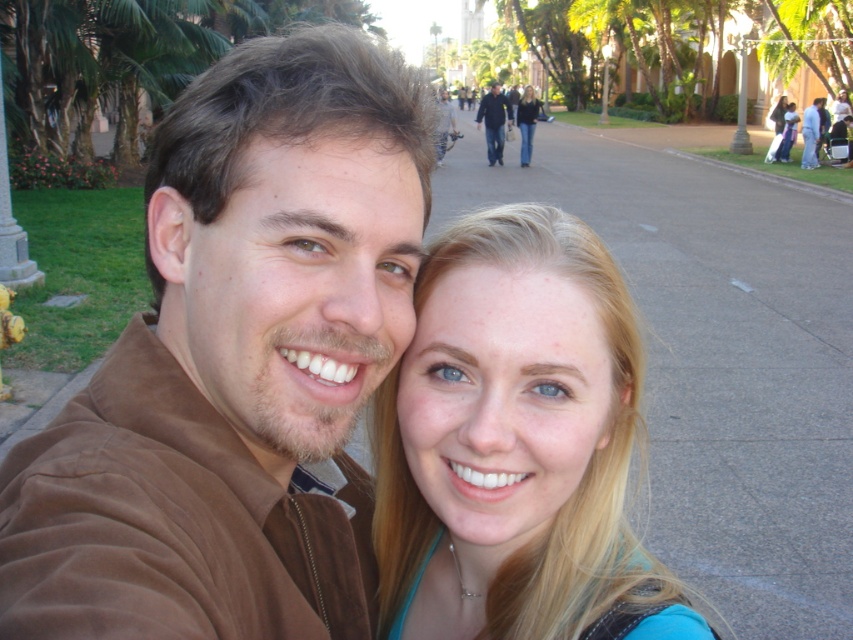
Question: Observing the image, what is the correct spatial positioning of blonde hair at center in reference to dark blue jeans at center?

Choices:
 (A) below
 (B) above

Answer: (A)

Question: Is matte brown jacket at upper right in front of blonde hair at upper center?

Choices:
 (A) yes
 (B) no

Answer: (A)

Question: Estimate the real-world distances between objects in this image. Which object is farther from the blue jeans at center?

Choices:
 (A) blonde hair at upper center
 (B) brown suede jacket at upper left

Answer: (B)

Question: Among these points, which one is farthest from the camera?

Choices:
 (A) (198, 278)
 (B) (486, 145)
 (C) (521, 108)
 (D) (518, 522)

Answer: (B)

Question: Which is nearer to the matte brown jacket at upper right?

Choices:
 (A) blonde hair at upper center
 (B) dark blue jeans at center
 (C) blue jeans at center

Answer: (A)

Question: Can you confirm if brown suede jacket at upper left is bigger than dark blue jeans at center?

Choices:
 (A) yes
 (B) no

Answer: (B)